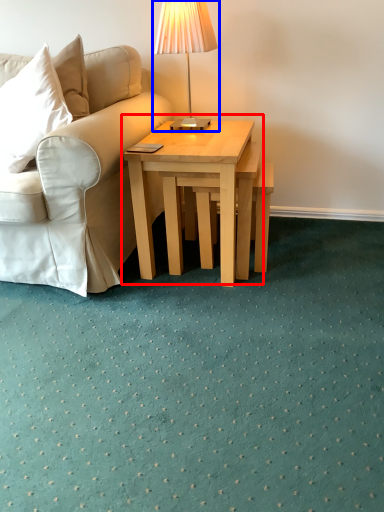
Question: Which point is closer to the camera, coffee table (highlighted by a red box) or table lamp (highlighted by a blue box)?

Choices:
 (A) coffee table
 (B) table lamp

Answer: (A)